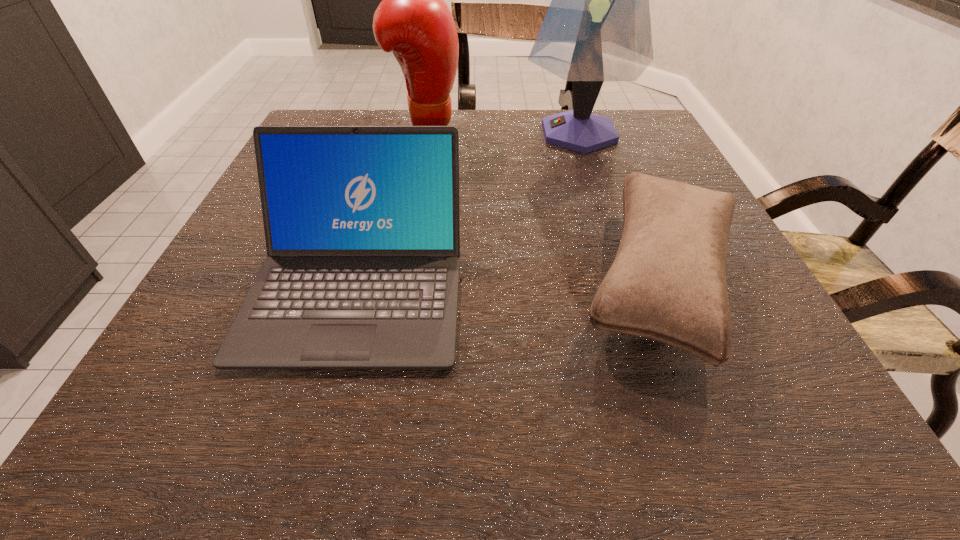
The height and width of the screenshot is (540, 960). What are the coordinates of `lampshade at the far edge` in the screenshot? It's located at (597, 28).

Where is `boxing glove positioned at the far edge`? This screenshot has width=960, height=540. boxing glove positioned at the far edge is located at coordinates (412, 21).

The height and width of the screenshot is (540, 960). Find the location of `object located in the near edge section of the desktop`. object located in the near edge section of the desktop is located at coordinates (668, 283).

In order to click on object that is at the left edge in this screenshot , I will do `click(362, 229)`.

Identify the location of lampshade present at the right edge. click(597, 28).

At what (x,y) coordinates should I click in order to perform the action: click on cushion that is positioned at the right edge. Please return your answer as a coordinate pair (x, y). Looking at the image, I should click on [x=668, y=283].

The width and height of the screenshot is (960, 540). In order to click on object located in the far right corner section of the desktop in this screenshot , I will do [x=597, y=28].

You are a GUI agent. You are given a task and a screenshot of the screen. Output one action in this format:
    pyautogui.click(x=<x>, y=<y>)
    Task: Click on the object positioned at the near right corner
    
    Given the screenshot: What is the action you would take?
    pyautogui.click(x=668, y=283)

What are the coordinates of `vacant space at the far edge of the desktop` in the screenshot? It's located at (488, 121).

Where is `free space at the near edge of the desktop`? The width and height of the screenshot is (960, 540). free space at the near edge of the desktop is located at coordinates (606, 400).